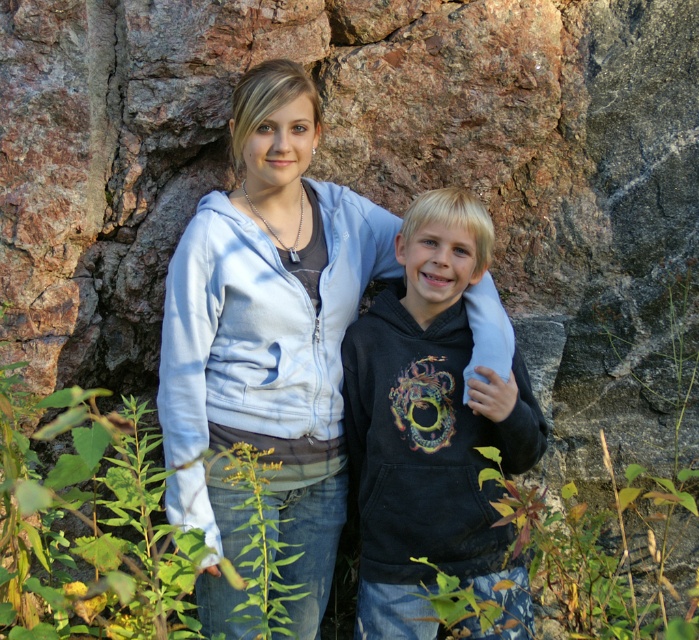
Is light blue zip-up hoodie at center wider than black matte hoodie at center?

Indeed, light blue zip-up hoodie at center has a greater width compared to black matte hoodie at center.

Identify the location of light blue zip-up hoodie at center. The width and height of the screenshot is (699, 640). (273, 317).